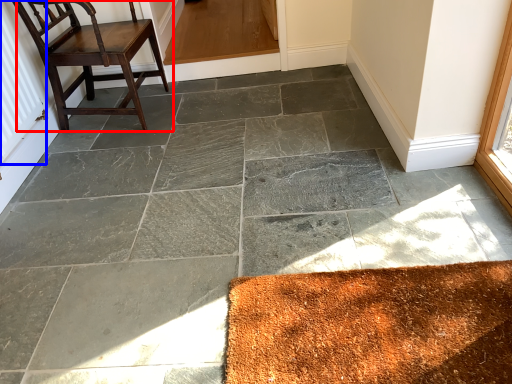
Question: Which of the following is the farthest to the observer, chair (highlighted by a red box) or radiator (highlighted by a blue box)?

Choices:
 (A) chair
 (B) radiator

Answer: (A)